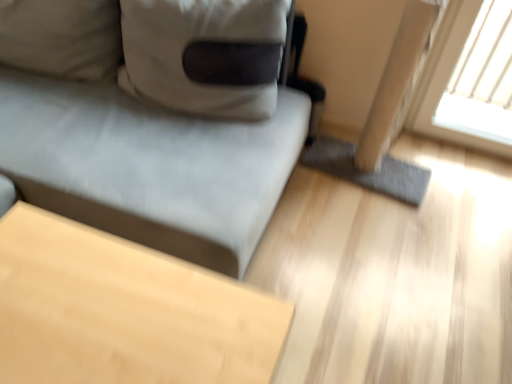
You are a GUI agent. You are given a task and a screenshot of the screen. Output one action in this format:
    pyautogui.click(x=<x>, y=<y>)
    Task: Click on the empty space that is ontop of light wood table at lower left
    The image size is (512, 384).
    Given the screenshot: What is the action you would take?
    pyautogui.click(x=111, y=314)